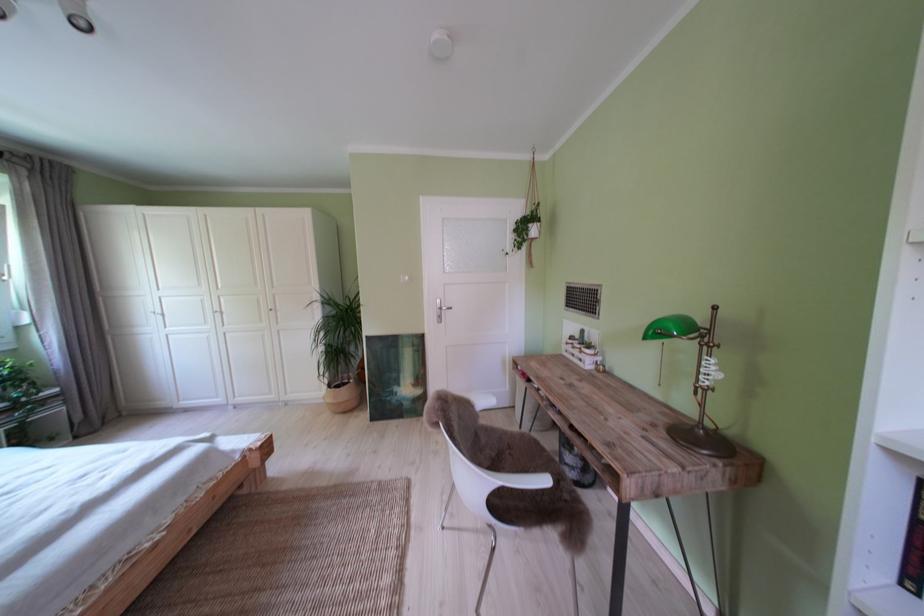
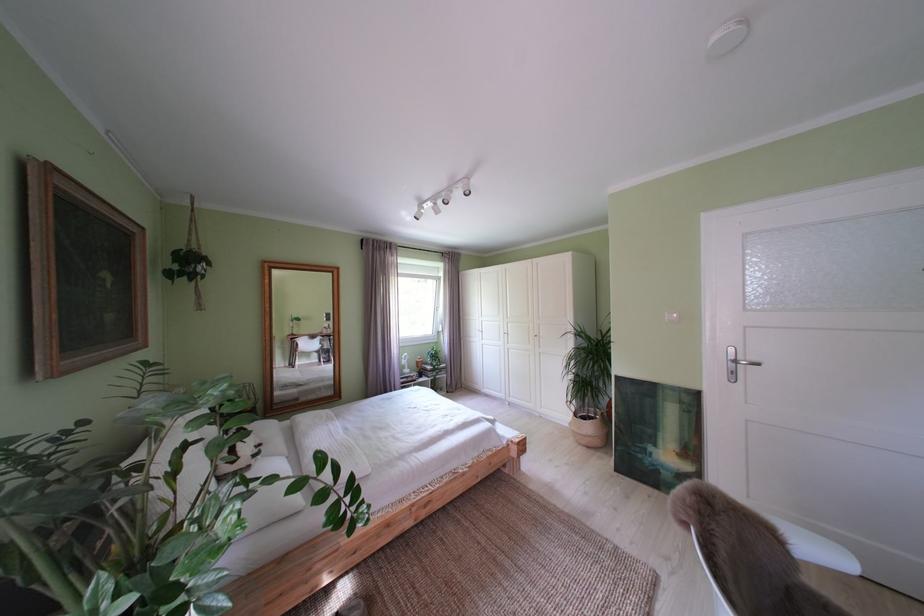
In the second image, find the point that corresponds to the point at 341,392 in the first image.

(587, 419)